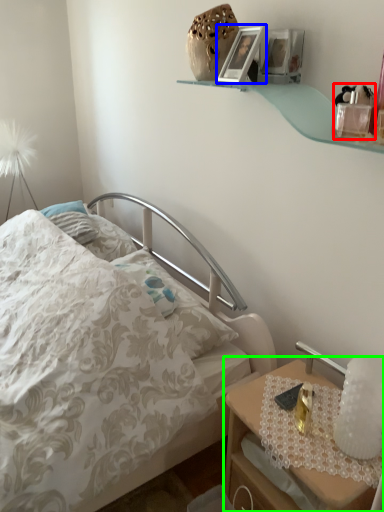
Question: Which object is positioned closest to toy (highlighted by a red box)? Select from picture frame (highlighted by a blue box) and nightstand (highlighted by a green box).

Choices:
 (A) picture frame
 (B) nightstand

Answer: (A)